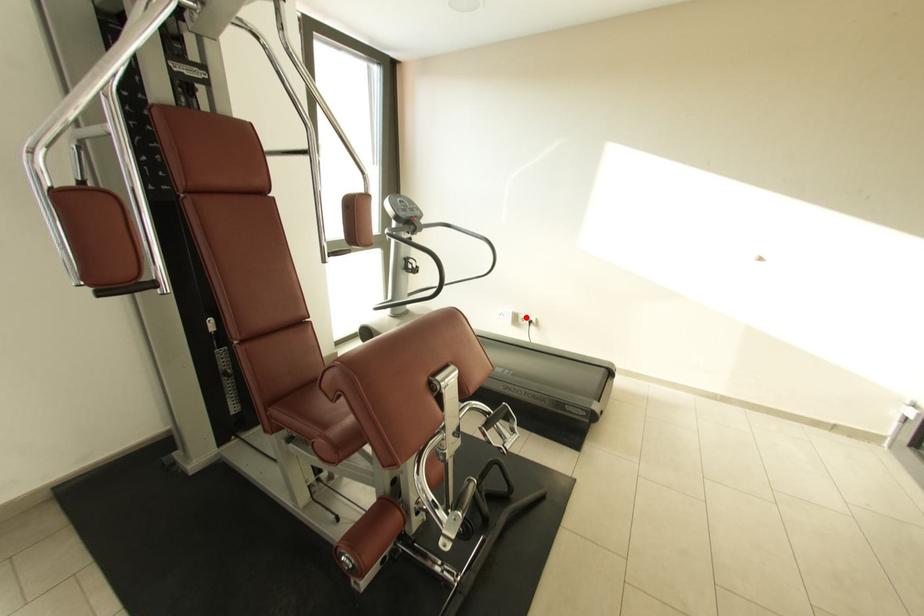
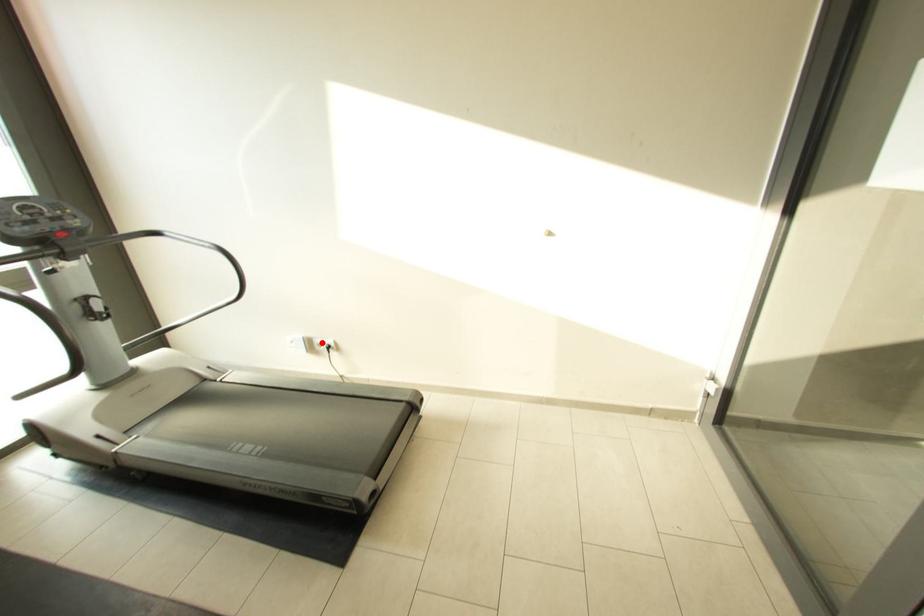
I am providing you with two images of the same scene from different viewpoints. A red point is marked on the first image and another point is marked on the second image. Is the red point in image1 aligned with the point shown in image2?

Yes